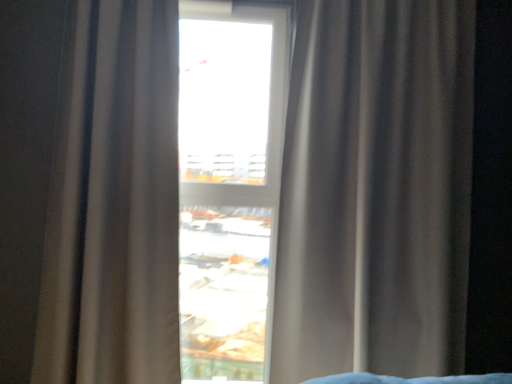
Question: Is satin beige curtain at center, which appears as the 1th curtain when viewed from the left, to the left or to the right of satin beige curtain at center, arranged as the 2th curtain when viewed from the left, in the image?

Choices:
 (A) right
 (B) left

Answer: (B)

Question: Do you think satin beige curtain at center, the second curtain viewed from the right, is within satin beige curtain at center, arranged as the 2th curtain when viewed from the left, or outside of it?

Choices:
 (A) outside
 (B) inside

Answer: (A)

Question: Which object is the closest to the transparent glass window at center?

Choices:
 (A) satin beige curtain at center, which appears as the 1th curtain when viewed from the left
 (B) satin beige curtain at center, which is the 1th curtain from right to left

Answer: (A)

Question: Estimate the real-world distances between objects in this image. Which object is farther from the transparent glass window at center?

Choices:
 (A) satin beige curtain at center, the second curtain viewed from the right
 (B) satin beige curtain at center, which is the 1th curtain from right to left

Answer: (B)